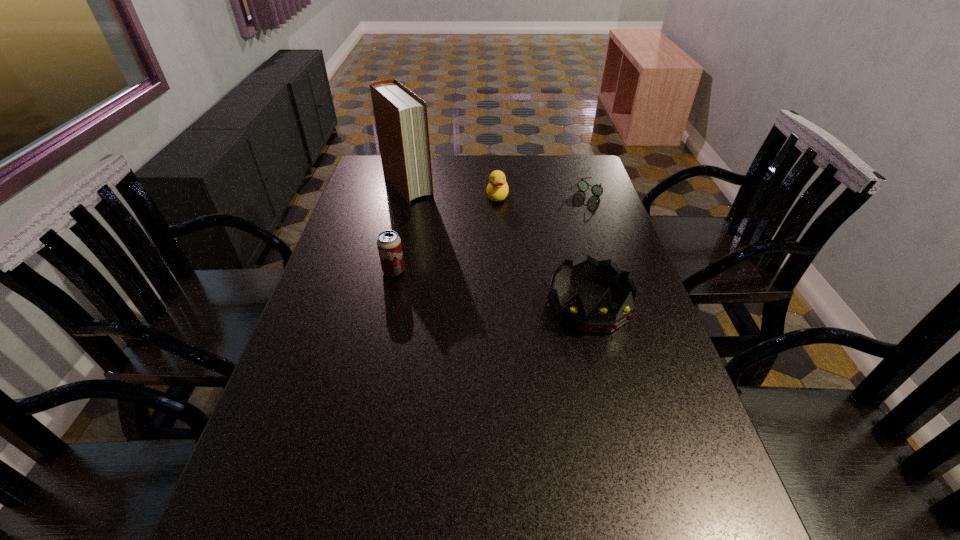
Image resolution: width=960 pixels, height=540 pixels. Find the location of `vacant spot on the desktop that is between the beer can and the fourth shortest object and is positioned on the face of the third object from right to left`. vacant spot on the desktop that is between the beer can and the fourth shortest object and is positioned on the face of the third object from right to left is located at coordinates coord(482,286).

The width and height of the screenshot is (960, 540). What are the coordinates of `vacant space on the desktop that is between the beer can and the tiara and is positioned on the open cover of the hardback book` in the screenshot? It's located at (501, 289).

Locate an element on the screen. The width and height of the screenshot is (960, 540). free space on the desktop that is between the beer can and the tiara and is positioned on the front-facing side of the spectacles is located at coordinates (491, 287).